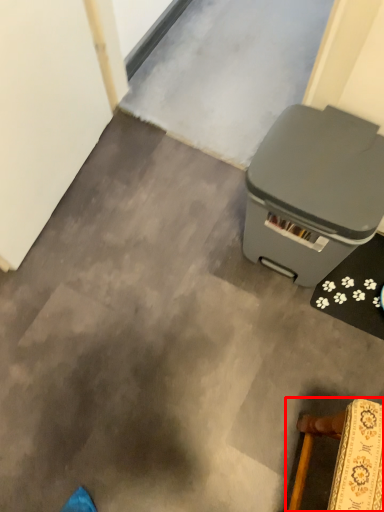
Question: From the image's perspective, what is the correct spatial relationship of furniture (annotated by the red box) in relation to waste container?

Choices:
 (A) below
 (B) above

Answer: (A)